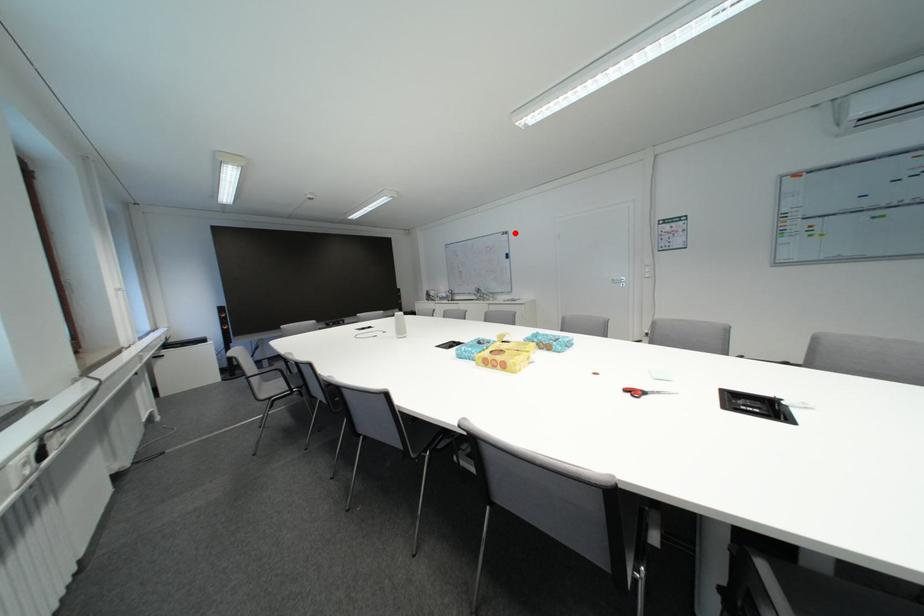
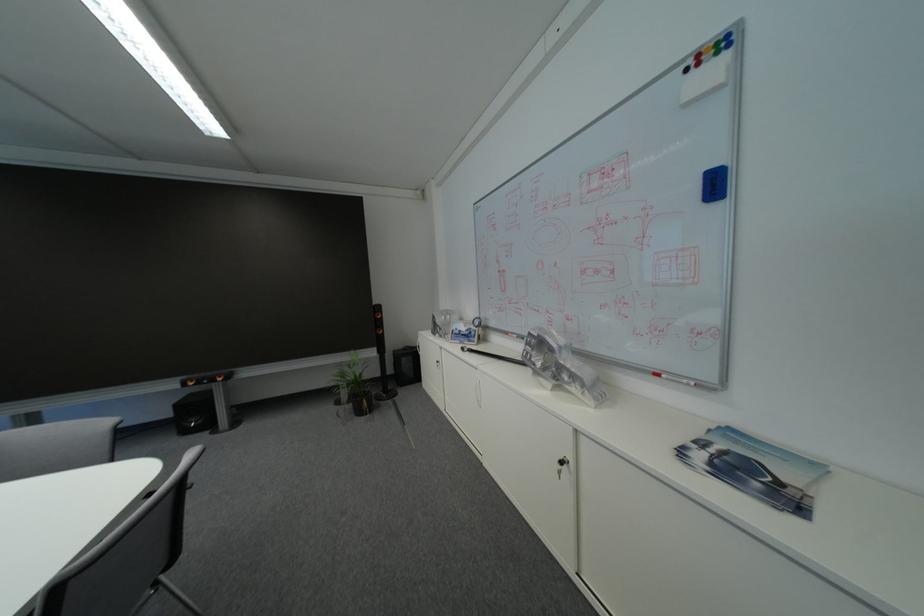
Question: I am providing you with two images of the same scene from different viewpoints. Image1 has a red point marked. In image2, the corresponding 3D location appears at what relative position? Reply with the corresponding letter.

Choices:
 (A) Closer
 (B) Farther

Answer: (B)